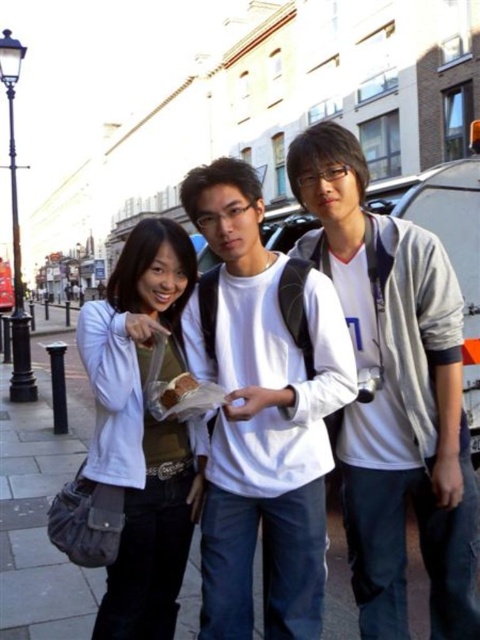
How far apart are white matte t-shirt at center and white matte jacket at upper left?

The distance of white matte t-shirt at center from white matte jacket at upper left is 1.13 meters.

Which is behind, point (269, 444) or point (139, 353)?

Point (139, 353)

The image size is (480, 640). Identify the location of white matte t-shirt at center. (262, 417).

Between white matte jacket at center and white matte jacket at upper left, which one has less height?

With less height is white matte jacket at center.

Is point (212, 497) less distant than point (120, 401)?

No.

At what (x,y) coordinates should I click in order to perform the action: click on white matte jacket at center. Please return your answer as a coordinate pair (x, y). Looking at the image, I should click on (405, 417).

Which is in front, point (205, 614) or point (379, 376)?

Point (205, 614)

Who is positioned more to the left, white matte jacket at center or white cotton shirt at center?

Positioned to the left is white cotton shirt at center.

Who is more distant from viewer, (256, 378) or (384, 227)?

Positioned behind is point (384, 227).

You are a GUI agent. You are given a task and a screenshot of the screen. Output one action in this format:
    pyautogui.click(x=<x>, y=<y>)
    Task: Click on the white matte jacket at center
    The height and width of the screenshot is (640, 480).
    Given the screenshot: What is the action you would take?
    pyautogui.click(x=405, y=417)